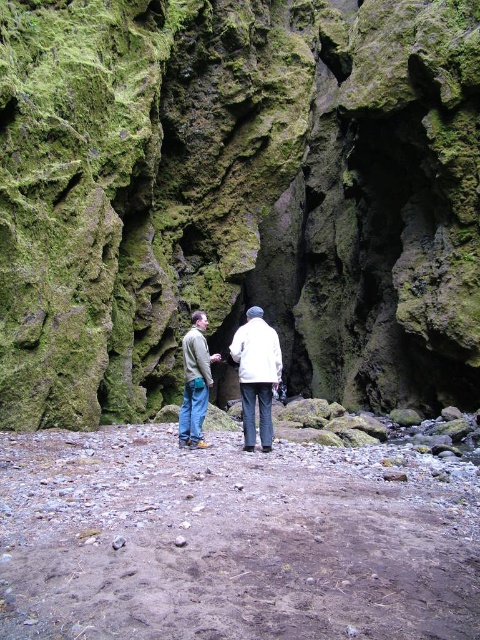
Who is higher up, green mossy rock at center or greenish-gray fabric jacket at center?

Positioned higher is green mossy rock at center.

Where is `green mossy rock at center`? green mossy rock at center is located at coordinates (237, 196).

Where is `green mossy rock at center`? The height and width of the screenshot is (640, 480). green mossy rock at center is located at coordinates click(237, 196).

Is white woolen jacket at center below greenish-gray fabric jacket at center?

No.

Who is positioned more to the left, white woolen jacket at center or greenish-gray fabric jacket at center?

From the viewer's perspective, greenish-gray fabric jacket at center appears more on the left side.

Does point (205, 444) lie in front of point (201, 332)?

No, it is not.

At what (x,y) coordinates should I click in order to perform the action: click on white woolen jacket at center. Please return your answer as a coordinate pair (x, y). Image resolution: width=480 pixels, height=640 pixels. Looking at the image, I should click on (257, 371).

From the picture: Is green mossy rock at center taller than white woolen jacket at center?

Indeed, green mossy rock at center has a greater height compared to white woolen jacket at center.

Is green mossy rock at center to the left of white woolen jacket at center from the viewer's perspective?

In fact, green mossy rock at center is to the right of white woolen jacket at center.

Find the location of a particular element. The width and height of the screenshot is (480, 640). green mossy rock at center is located at coordinates (237, 196).

You are a GUI agent. You are given a task and a screenshot of the screen. Output one action in this format:
    pyautogui.click(x=<x>, y=<y>)
    Task: Click on the green mossy rock at center
    This screenshot has width=480, height=640.
    Given the screenshot: What is the action you would take?
    pyautogui.click(x=237, y=196)